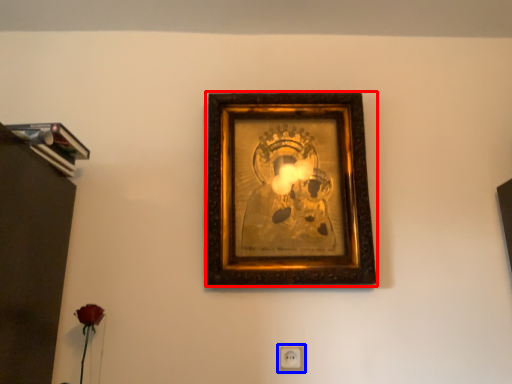
Question: Which point is further to the camera, picture frame (highlighted by a red box) or electric outlet (highlighted by a blue box)?

Choices:
 (A) picture frame
 (B) electric outlet

Answer: (B)